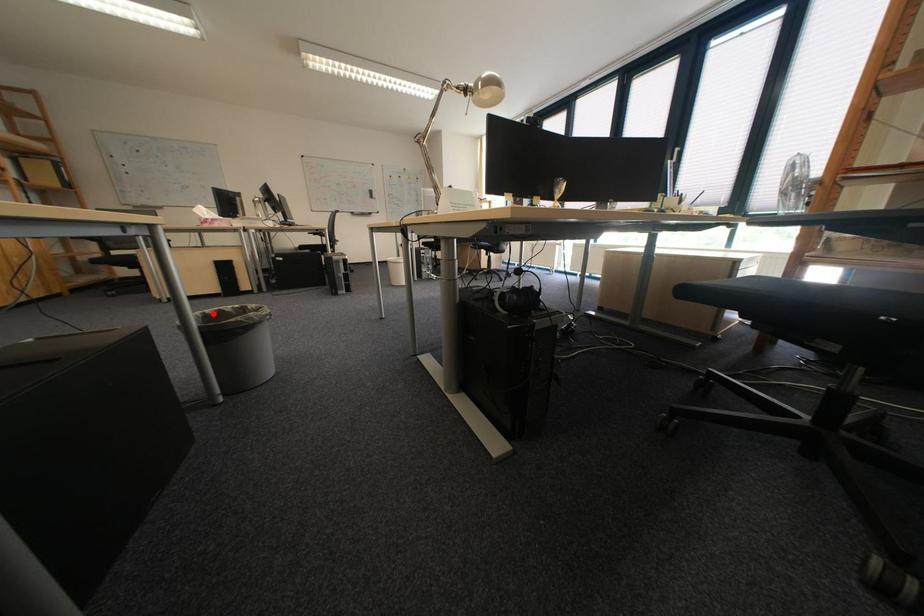
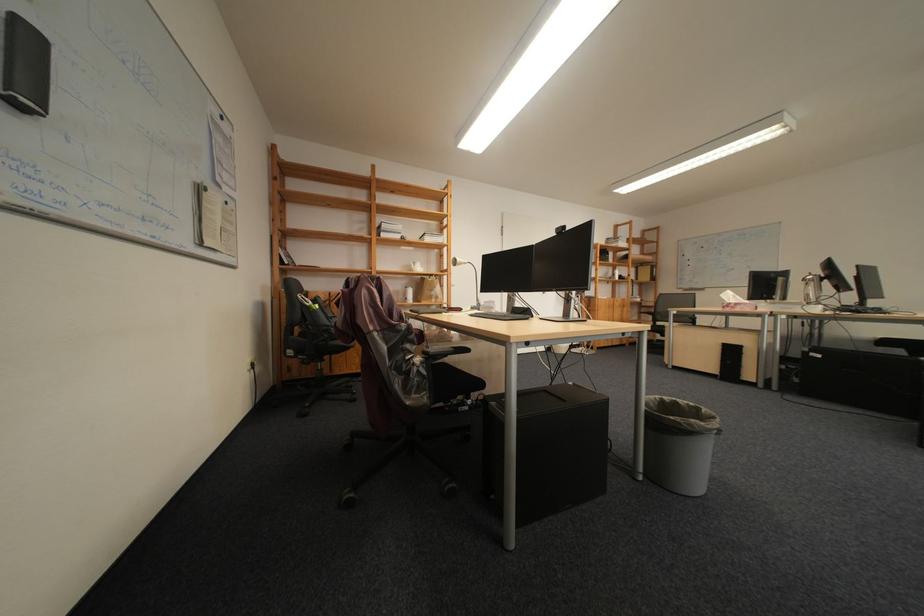
Locate, in the second image, the point that corresponds to the highlighted location in the first image.

(673, 398)